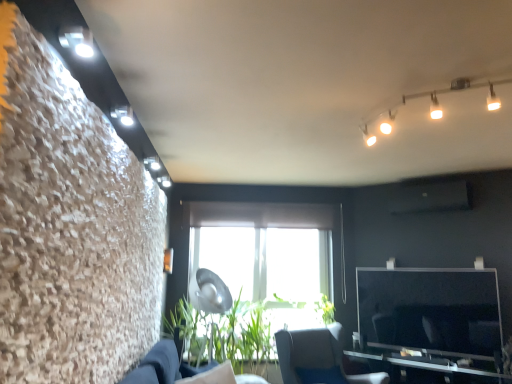
Question: Considering the relative sizes of green leafy plant at center and dark blue fabric couch at lower center in the image provided, is green leafy plant at center shorter than dark blue fabric couch at lower center?

Choices:
 (A) no
 (B) yes

Answer: (A)

Question: Is green leafy plant at center aimed at dark blue fabric couch at lower center?

Choices:
 (A) yes
 (B) no

Answer: (A)

Question: Considering the relative positions of green leafy plant at center and dark blue fabric couch at lower center in the image provided, is green leafy plant at center to the right of dark blue fabric couch at lower center from the viewer's perspective?

Choices:
 (A) no
 (B) yes

Answer: (A)

Question: Is green leafy plant at center taller than dark blue fabric couch at lower center?

Choices:
 (A) no
 (B) yes

Answer: (B)

Question: From the image's perspective, does green leafy plant at center appear lower than dark blue fabric couch at lower center?

Choices:
 (A) no
 (B) yes

Answer: (B)

Question: From a real-world perspective, is green leafy plant at center under dark blue fabric couch at lower center?

Choices:
 (A) no
 (B) yes

Answer: (A)

Question: Could you tell me if dark blue fabric couch at lower center is facing green leafy plant at center?

Choices:
 (A) no
 (B) yes

Answer: (A)

Question: From the image's perspective, does dark blue fabric couch at lower center appear higher than green leafy plant at center?

Choices:
 (A) no
 (B) yes

Answer: (B)

Question: Does dark blue fabric couch at lower center have a larger size compared to green leafy plant at center?

Choices:
 (A) no
 (B) yes

Answer: (A)

Question: From a real-world perspective, is dark blue fabric couch at lower center over green leafy plant at center?

Choices:
 (A) no
 (B) yes

Answer: (A)

Question: Is dark blue fabric couch at lower center at the right side of green leafy plant at center?

Choices:
 (A) yes
 (B) no

Answer: (A)

Question: Does dark blue fabric couch at lower center have a smaller size compared to green leafy plant at center?

Choices:
 (A) no
 (B) yes

Answer: (B)

Question: Does white glossy track lights at upper right appear on the left side of dark blue fabric couch at lower center?

Choices:
 (A) no
 (B) yes

Answer: (A)